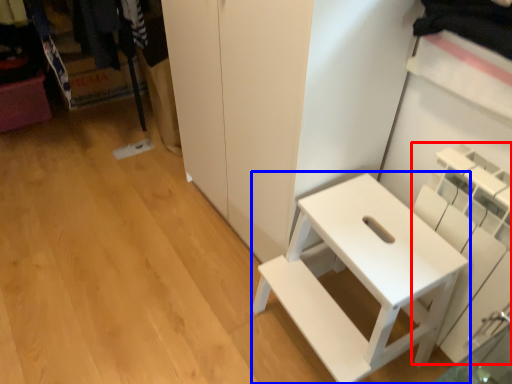
Question: Which of the following is the farthest to the observer, shelf (highlighted by a red box) or furniture (highlighted by a blue box)?

Choices:
 (A) shelf
 (B) furniture

Answer: (B)